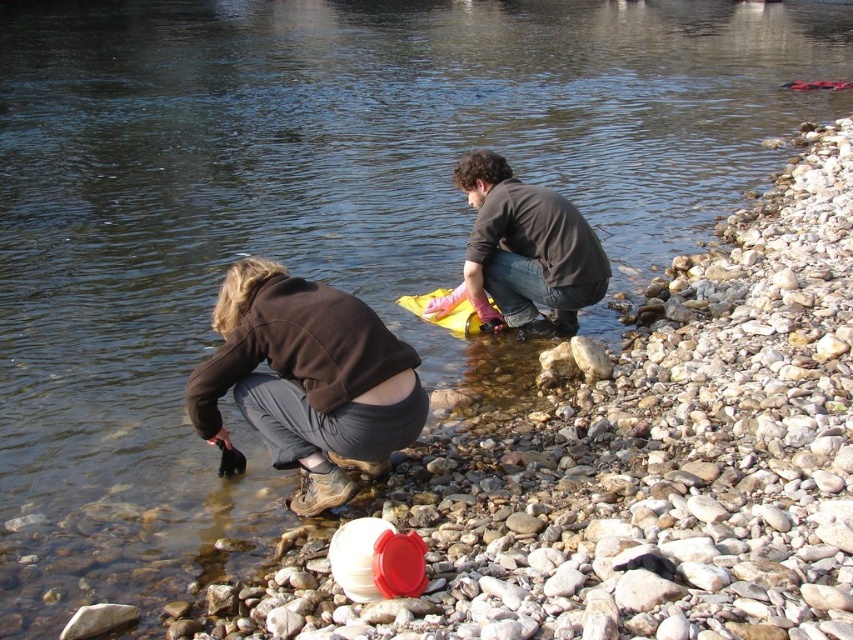
What is the 2D coordinate of the brown leather boots at lower left in the image?

The 2D coordinate of the brown leather boots at lower left is at point (306, 378).

You are a hiker who needs to cross the river between the brown leather boots at lower left and the dark brown shirt at center. Your backpack has a width of 1.5 meters. Can you safely cross the river between these two points without your backpack getting wet?

The distance between the brown leather boots at lower left and the dark brown shirt at center is 2.87 meters. Since your backpack is only 1.5 meters wide, you can safely cross the river between these two points without your backpack getting wet as the distance is sufficient.

You are a photographer trying to capture both the brown leather boots at lower left and the dark brown shirt at center in a single frame. Which object should you focus on first if you want to ensure both are in focus?

The brown leather boots at lower left has a lesser height compared to dark brown shirt at center, so you should focus on the dark brown shirt at center first to ensure both are in focus since it is taller and might be further away.